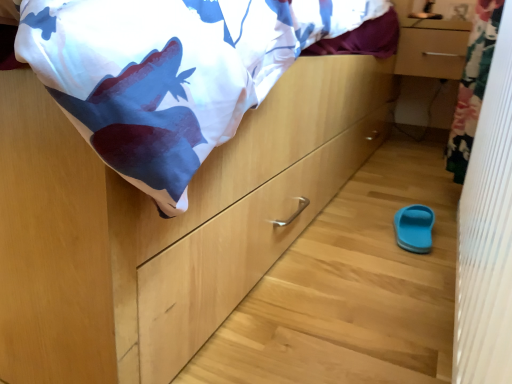
Question: In terms of size, does matte wood drawer at upper right appear bigger or smaller than white textured curtain at right?

Choices:
 (A) big
 (B) small

Answer: (B)

Question: In terms of height, does matte wood drawer at upper right look taller or shorter compared to white textured curtain at right?

Choices:
 (A) tall
 (B) short

Answer: (B)

Question: Which object is the closest to the matte wood drawer at upper right?

Choices:
 (A) blue rubber slipper at lower right
 (B) white textured curtain at right

Answer: (A)

Question: Estimate the real-world distances between objects in this image. Which object is farther from the matte wood drawer at upper right?

Choices:
 (A) white textured curtain at right
 (B) blue rubber slipper at lower right

Answer: (A)